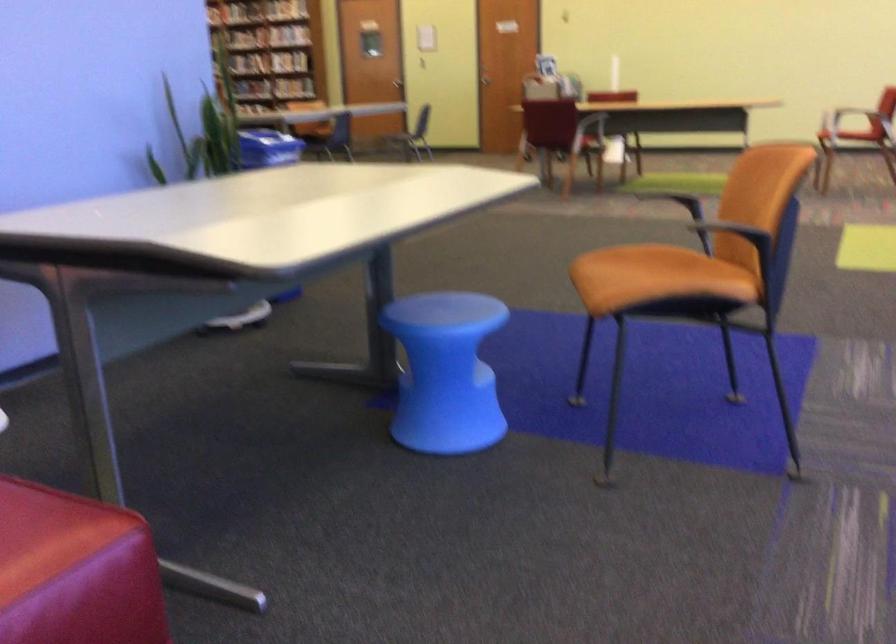
Where would you sit the red sofa sitting surface? Please return your answer as a coordinate pair (x, y).

(47, 534)